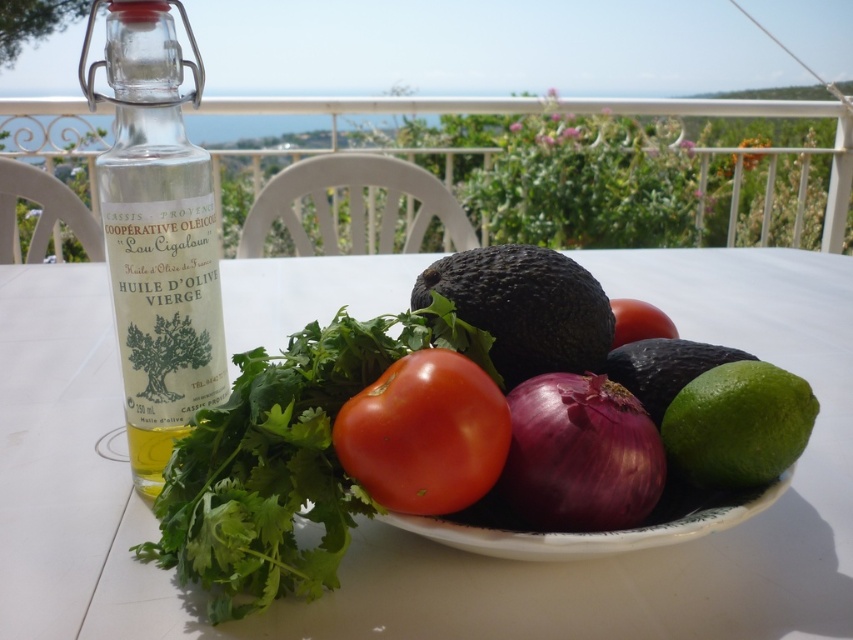
Question: Which of the following is the farthest from the observer?

Choices:
 (A) black matte avocado at center
 (B) white glossy table at center
 (C) green matte lime at lower right
 (D) red matte tomato at center

Answer: (D)

Question: Which of these objects is positioned farthest from the purple matte onion at center?

Choices:
 (A) clear glass bottle at left
 (B) black matte avocado at center
 (C) red matte tomato at center
 (D) green matte lime at lower right

Answer: (A)

Question: Which of the following is the farthest from the observer?

Choices:
 (A) (650, 458)
 (B) (718, 436)

Answer: (B)

Question: Does red smooth tomato at center have a lesser width compared to clear glass bottle at left?

Choices:
 (A) no
 (B) yes

Answer: (A)

Question: Does clear glass bottle at left appear over green matte avocado at lower right?

Choices:
 (A) yes
 (B) no

Answer: (A)

Question: In this image, where is shiny red tomato at center located relative to purple matte onion at center?

Choices:
 (A) right
 (B) left

Answer: (B)